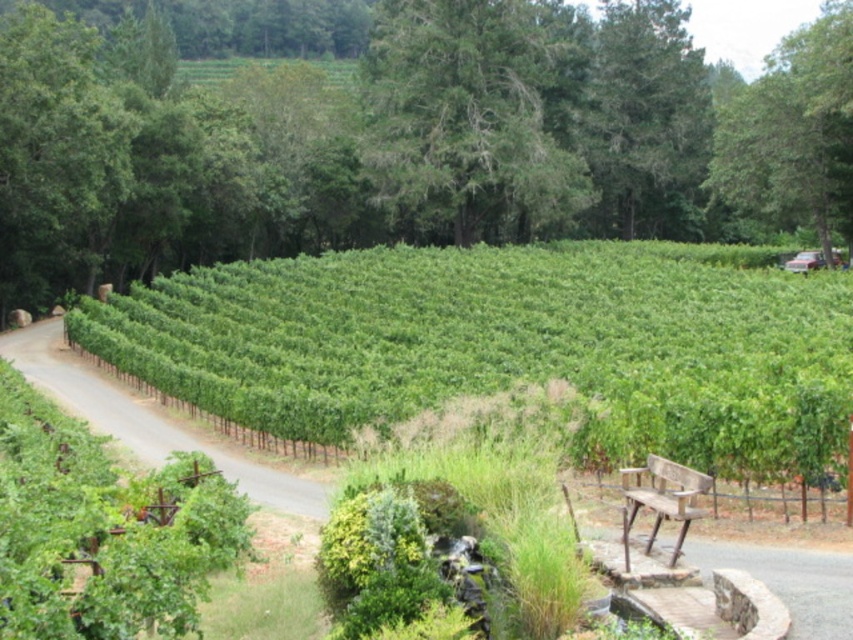
You are a tourist visiting the vineyard and want to take a photo of the wooden bench at lower right while also including the green leafy tree at upper center in the frame. Based on their positions, will you need to adjust your camera angle upwards or downwards to include both in the shot?

The green leafy tree at upper center is located above the wooden bench at lower right, so you will need to adjust your camera angle upwards to include both in the shot.

You are planning to place a small garden statue between the green textured tree at center and the green leafy tree at upper right. Considering their sizes, which tree will have more space between them and the statue?

The green textured tree at center has a larger width than the green leafy tree at upper right, so placing the statue between them would leave more space next to the green leafy tree at upper right.